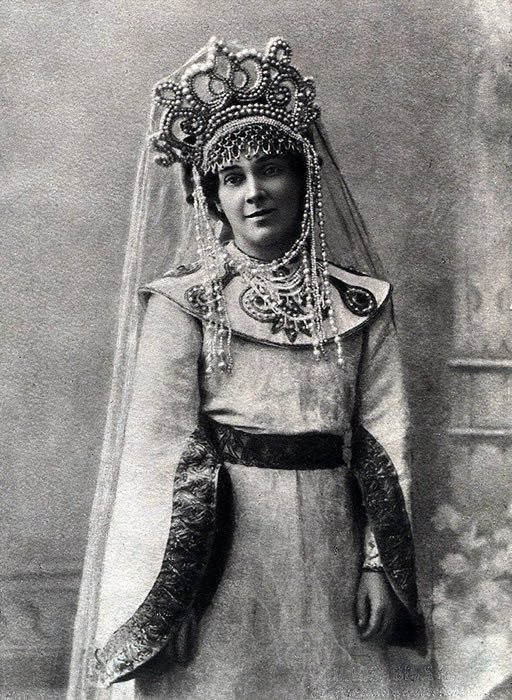
Identify the location of plant. The width and height of the screenshot is (512, 700). (492, 579).